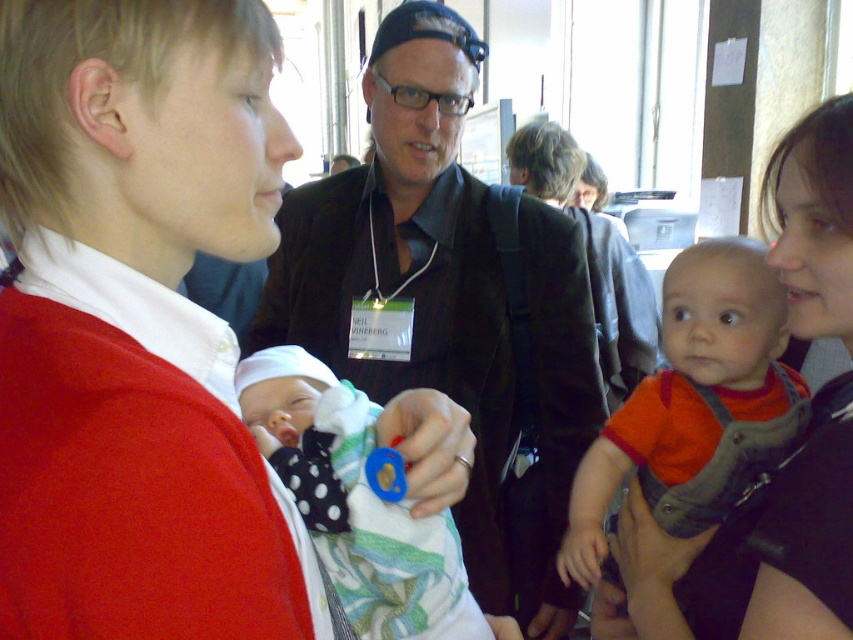
You are a photographer at the event and want to capture a closeup of the baby in the matte black baby carrier at center. However, the blue rubber teething ring at center is blocking your view. Can you adjust your angle to see the baby?

The matte black baby carrier at center is located below the blue rubber teething ring at center, so adjusting your angle downward might allow you to see the baby without the teething ring blocking the view.

You are a photographer at this event and need to capture a closeup shot of both the matte black baby carrier at center and the blue rubber pacifier at center without moving the objects. Can you fit both into your camera frame if your lens has a maximum field of view of 14 inches?

The distance between the matte black baby carrier at center and the blue rubber pacifier at center is 14.75 inches, which exceeds the camera lens field of view of 14 inches. Therefore, you cannot fit both into the frame without moving the objects.